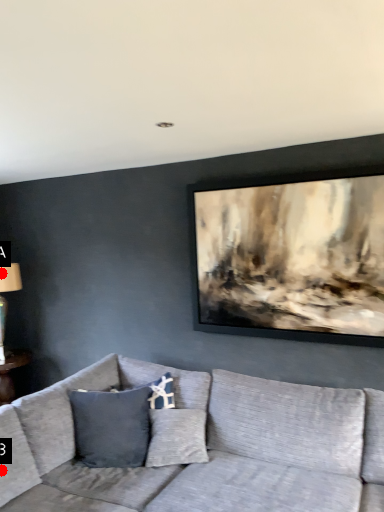
Question: Two points are circled on the image, labeled by A and B beside each circle. Which point is further to the camera?

Choices:
 (A) A is further
 (B) B is further

Answer: (A)